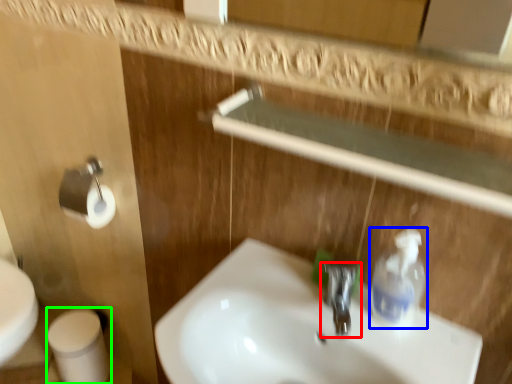
Question: Which object is the closest to the tap (highlighted by a red box)? Choose among these: cleaning product (highlighted by a blue box) or toilet paper (highlighted by a green box).

Choices:
 (A) cleaning product
 (B) toilet paper

Answer: (A)